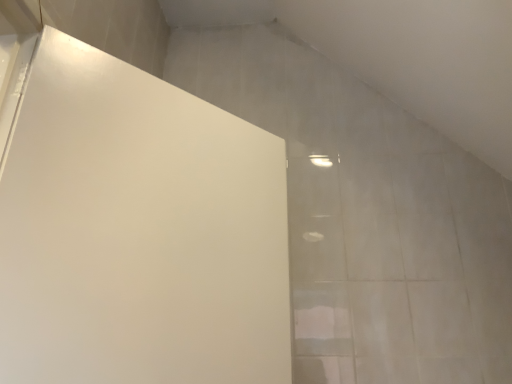
Measure the distance between point [96,329] and camera.

Point [96,329] and camera are 33.27 inches apart.

Image resolution: width=512 pixels, height=384 pixels. Describe the element at coordinates (138, 232) in the screenshot. I see `white glossy door at upper left` at that location.

The width and height of the screenshot is (512, 384). Identify the location of white glossy door at upper left. (138, 232).

Locate an element on the screen. The image size is (512, 384). white glossy door at upper left is located at coordinates (138, 232).